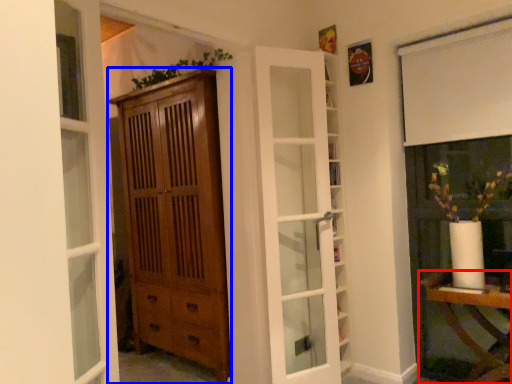
Question: Which object appears closest to the camera in this image, table (highlighted by a red box) or cabinetry (highlighted by a blue box)?

Choices:
 (A) table
 (B) cabinetry

Answer: (A)